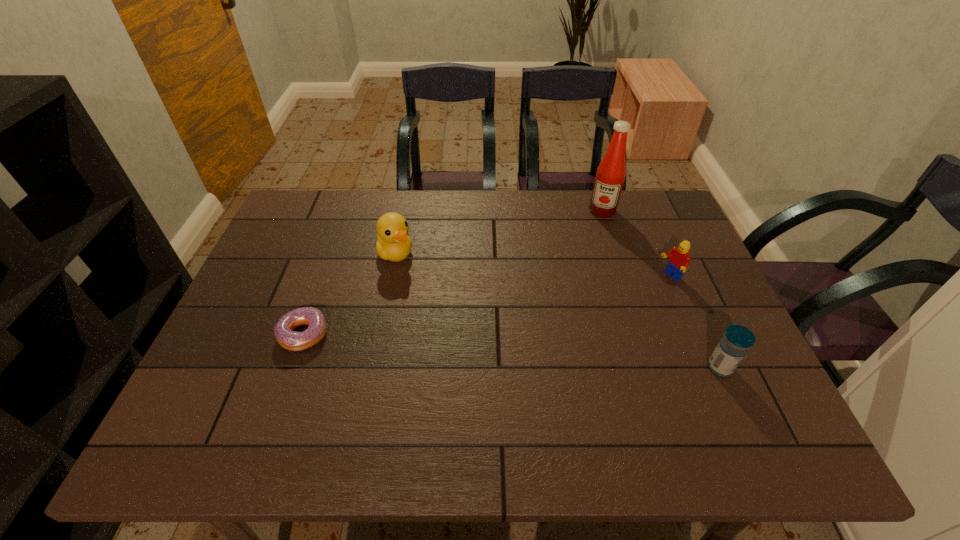
Identify which object is the fourth closest to the Lego. Please provide its 2D coordinates. Your answer should be formatted as a tuple, i.e. [(x, y)], where the tuple contains the x and y coordinates of a point satisfying the conditions above.

[(294, 341)]

Where is `the fourth closest object to the second nearest object`? The height and width of the screenshot is (540, 960). the fourth closest object to the second nearest object is located at coordinates (733, 346).

You are a GUI agent. You are given a task and a screenshot of the screen. Output one action in this format:
    pyautogui.click(x=<x>, y=<y>)
    Task: Click on the free space that satisfies the following two spatial constraints: 1. on the back side of the Lego; 2. on the right side of the doughnut
    
    Given the screenshot: What is the action you would take?
    pyautogui.click(x=324, y=276)

Locate an element on the screen. The image size is (960, 540). vacant area that satisfies the following two spatial constraints: 1. on the back side of the Lego; 2. on the left side of the doughnut is located at coordinates (324, 276).

Locate an element on the screen. vacant space that satisfies the following two spatial constraints: 1. on the back side of the tallest object; 2. on the left side of the fourth farthest object is located at coordinates (348, 211).